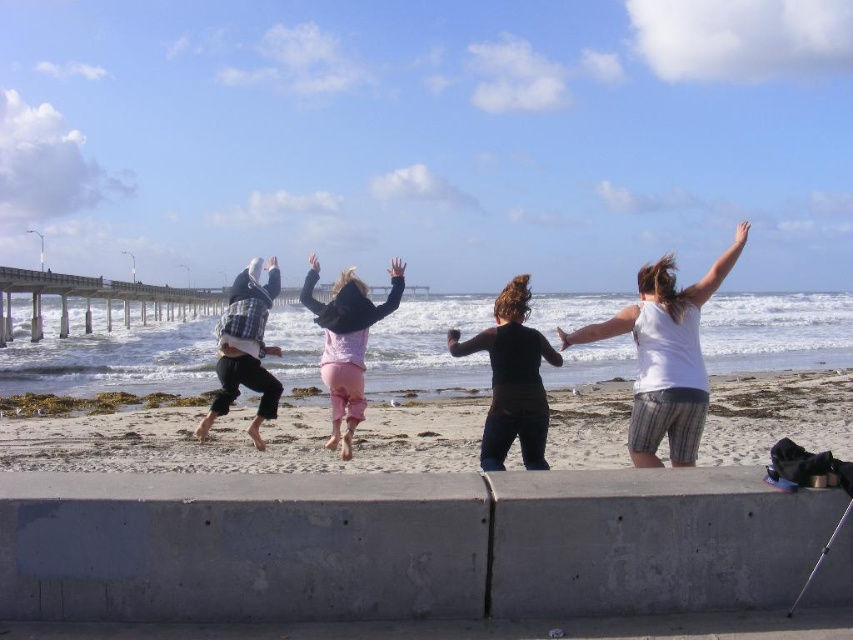
Question: Which object is the closest to the plaid shirt at center?

Choices:
 (A) matte black arm at upper center
 (B) white cotton tank top at center
 (C) matte black arm at center
 (D) white matte arm at upper right

Answer: (C)

Question: Can you confirm if pink fleece jacket at center is positioned above plaid shirt at center?

Choices:
 (A) yes
 (B) no

Answer: (A)

Question: Can you confirm if plaid shirt at center is positioned below white matte arm at upper center?

Choices:
 (A) yes
 (B) no

Answer: (A)

Question: Which of the following is the closest to the observer?

Choices:
 (A) matte black arm at upper center
 (B) concrete ledge at lower center

Answer: (B)

Question: Among these points, which one is farthest from the camera?

Choices:
 (A) 604,332
 (B) 727,428
 (C) 473,348
 (D) 393,291

Answer: (B)

Question: Is dark brown shirt at center in front of white matte arm at upper right?

Choices:
 (A) no
 (B) yes

Answer: (A)